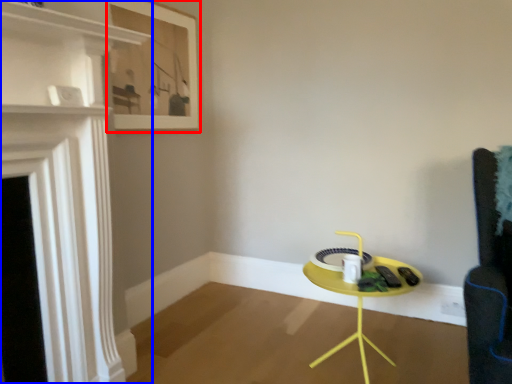
Question: Which object appears closest to the camera in this image, picture frame (highlighted by a red box) or fireplace (highlighted by a blue box)?

Choices:
 (A) picture frame
 (B) fireplace

Answer: (B)